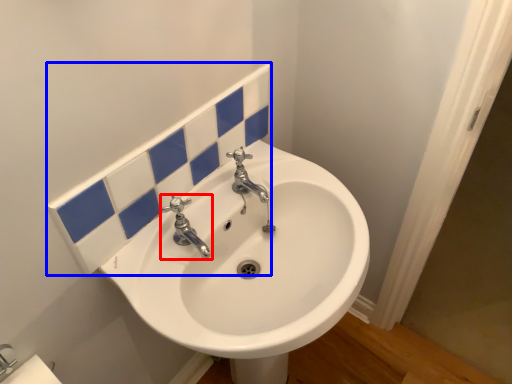
Question: Among these objects, which one is nearest to the camera, tap (highlighted by a red box) or tile (highlighted by a blue box)?

Choices:
 (A) tap
 (B) tile

Answer: (B)